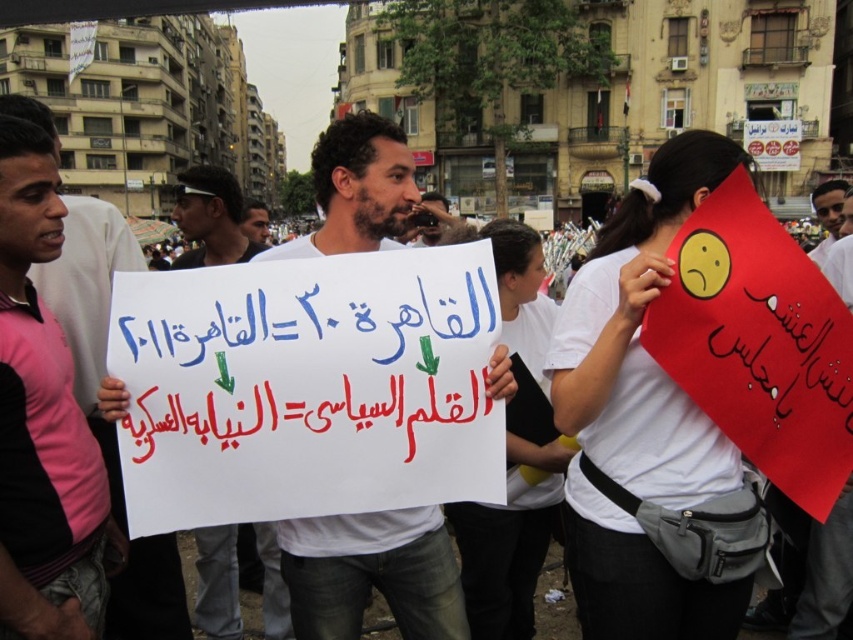
Is white paper sign at center further to camera compared to matte white shirt at center?

No.

Based on the photo, does white paper sign at center have a greater height compared to matte white shirt at center?

Yes, white paper sign at center is taller than matte white shirt at center.

Which is in front, point (386, 204) or point (253, 224)?

Point (386, 204) is more forward.

Find the location of `white paper sign at center`. white paper sign at center is located at coordinates (372, 573).

Between point (20, 570) and point (802, 445), which one is positioned behind?

Point (802, 445)

Does pink jersey at center have a greater height compared to matte red sign at right?

Yes, pink jersey at center is taller than matte red sign at right.

This screenshot has height=640, width=853. In order to click on pink jersey at center in this screenshot , I will do `click(41, 420)`.

Is red paper sign at upper right positioned before matte red sign at right?

No, it is behind matte red sign at right.

Is point (759, 272) in front of point (697, 394)?

No, (759, 272) is further to viewer.

Locate an element on the screen. Image resolution: width=853 pixels, height=640 pixels. red paper sign at upper right is located at coordinates (758, 342).